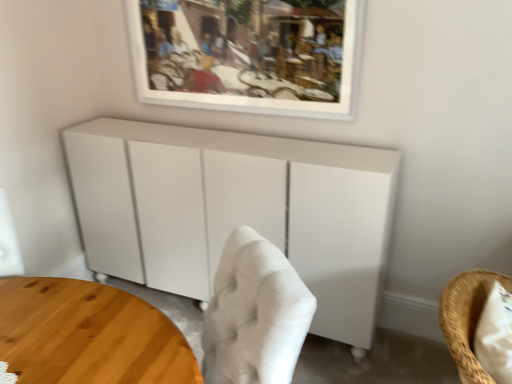
Question: Does woven straw chair at lower right appear on the left side of white matte picture frame at upper center?

Choices:
 (A) no
 (B) yes

Answer: (A)

Question: Does woven straw chair at lower right have a greater height compared to white matte picture frame at upper center?

Choices:
 (A) no
 (B) yes

Answer: (A)

Question: Is woven straw chair at lower right positioned in front of white matte picture frame at upper center?

Choices:
 (A) yes
 (B) no

Answer: (A)

Question: Can you confirm if woven straw chair at lower right is wider than white matte picture frame at upper center?

Choices:
 (A) no
 (B) yes

Answer: (B)

Question: Is woven straw chair at lower right not within white matte picture frame at upper center?

Choices:
 (A) yes
 (B) no

Answer: (A)

Question: In terms of height, does white matte cabinet at center look taller or shorter compared to woven straw chair at lower right?

Choices:
 (A) tall
 (B) short

Answer: (A)

Question: Does point (151, 228) appear closer or farther from the camera than point (482, 269)?

Choices:
 (A) farther
 (B) closer

Answer: (A)

Question: Is white matte cabinet at center in front of or behind woven straw chair at lower right in the image?

Choices:
 (A) front
 (B) behind

Answer: (B)

Question: In the image, is white matte cabinet at center on the left side or the right side of woven straw chair at lower right?

Choices:
 (A) left
 (B) right

Answer: (A)

Question: Would you say wooden round table at lower left is to the left or to the right of white matte cabinet at center in the picture?

Choices:
 (A) left
 (B) right

Answer: (A)

Question: In terms of width, does wooden round table at lower left look wider or thinner when compared to white matte cabinet at center?

Choices:
 (A) wide
 (B) thin

Answer: (A)

Question: Is point (83, 337) positioned closer to the camera than point (347, 327)?

Choices:
 (A) closer
 (B) farther

Answer: (A)

Question: From the image's perspective, is wooden round table at lower left above or below white matte cabinet at center?

Choices:
 (A) below
 (B) above

Answer: (A)

Question: Is wooden round table at lower left to the left or to the right of woven straw chair at lower right in the image?

Choices:
 (A) left
 (B) right

Answer: (A)

Question: Looking at their shapes, would you say wooden round table at lower left is wider or thinner than woven straw chair at lower right?

Choices:
 (A) thin
 (B) wide

Answer: (B)